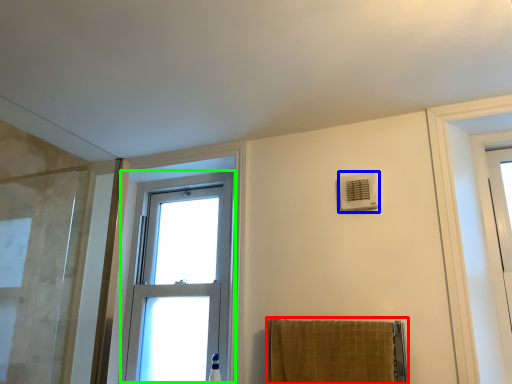
Question: Based on their relative distances, which object is farther from towel (highlighted by a red box)? Choose from air conditioning (highlighted by a blue box) and window (highlighted by a green box).

Choices:
 (A) air conditioning
 (B) window

Answer: (B)